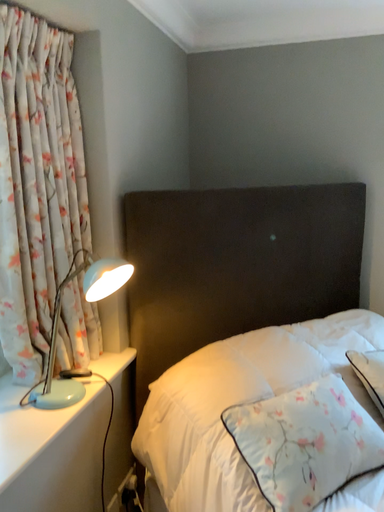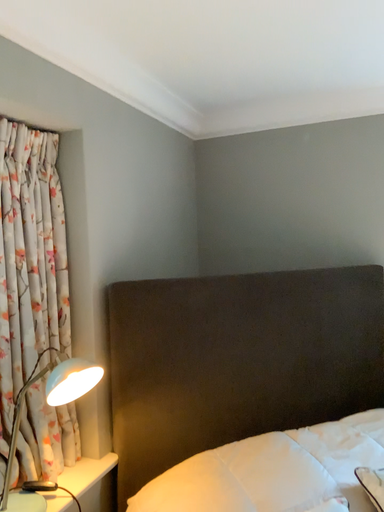
Question: Which way did the camera rotate in the video?

Choices:
 (A) rotated right
 (B) rotated left

Answer: (B)